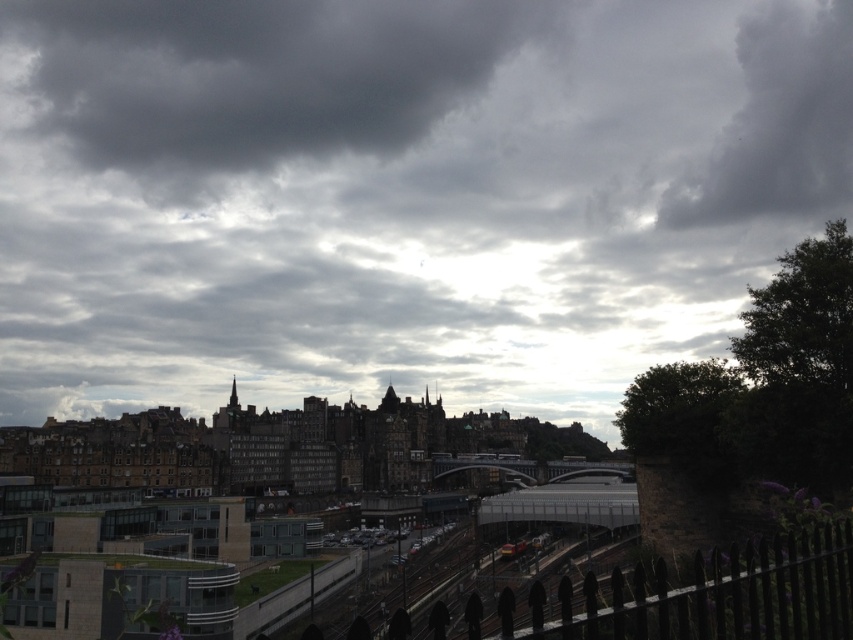
You are an architect designing a new observatory. The observatory must have a window that always faces the dark gray cloud at upper center. Given that the observatory will be built at the coordinates where the railway track and bridge intersect, can you determine the direction the window should face based on the cloud location?

The dark gray cloud at upper center is located at coordinates point (251,77), so the window should be oriented towards that point to face the dark gray cloud at upper center.